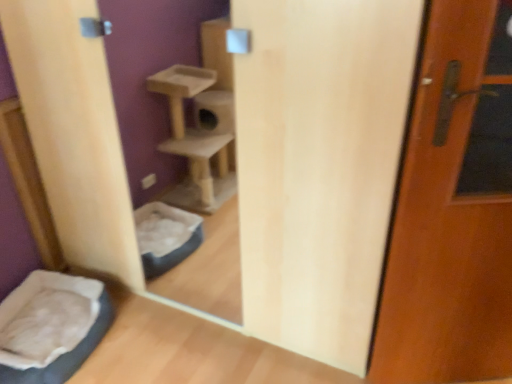
Question: Can you confirm if soft white fabric at lower left is taller than brown wooden door at right?

Choices:
 (A) no
 (B) yes

Answer: (A)

Question: Is there a large distance between soft white fabric at lower left and brown wooden door at right?

Choices:
 (A) no
 (B) yes

Answer: (B)

Question: Considering the relative positions of soft white fabric at lower left and brown wooden door at right in the image provided, is soft white fabric at lower left to the right of brown wooden door at right from the viewer's perspective?

Choices:
 (A) yes
 (B) no

Answer: (B)

Question: Does soft white fabric at lower left lie in front of brown wooden door at right?

Choices:
 (A) yes
 (B) no

Answer: (B)

Question: From a real-world perspective, is soft white fabric at lower left positioned under brown wooden door at right based on gravity?

Choices:
 (A) no
 (B) yes

Answer: (B)

Question: From a real-world perspective, does soft white fabric at lower left stand above brown wooden door at right?

Choices:
 (A) yes
 (B) no

Answer: (B)

Question: From the image's perspective, is brown wooden door at right on top of soft white fabric at lower left?

Choices:
 (A) no
 (B) yes

Answer: (B)

Question: Is brown wooden door at right wider than soft white fabric at lower left?

Choices:
 (A) yes
 (B) no

Answer: (B)

Question: Is brown wooden door at right positioned beyond the bounds of soft white fabric at lower left?

Choices:
 (A) no
 (B) yes

Answer: (B)

Question: Is brown wooden door at right with soft white fabric at lower left?

Choices:
 (A) yes
 (B) no

Answer: (B)

Question: Is the depth of brown wooden door at right less than that of soft white fabric at lower left?

Choices:
 (A) no
 (B) yes

Answer: (B)

Question: Does brown wooden door at right have a lesser width compared to soft white fabric at lower left?

Choices:
 (A) yes
 (B) no

Answer: (A)

Question: Choose the correct answer: Is soft white fabric at lower left inside brown wooden door at right or outside it?

Choices:
 (A) inside
 (B) outside

Answer: (B)